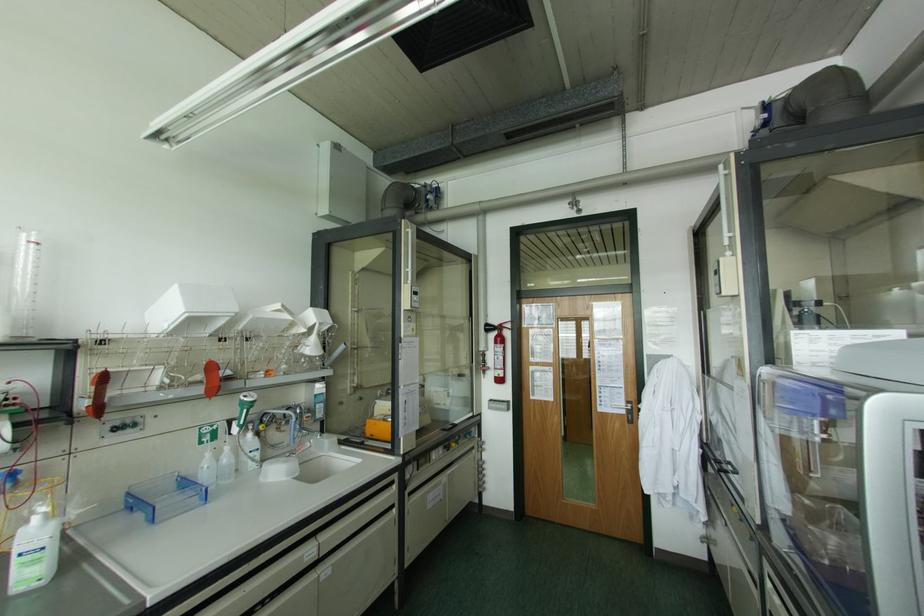
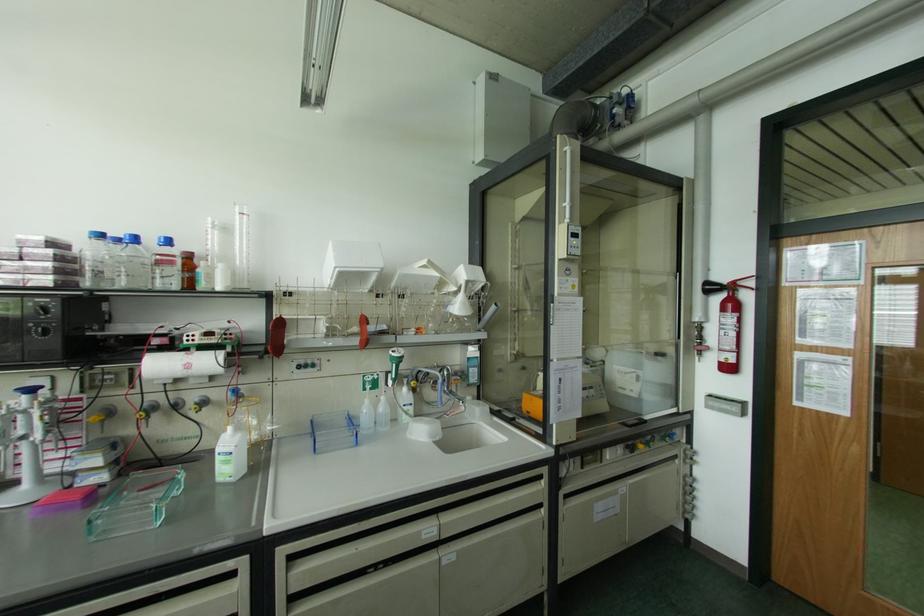
Locate, in the second image, the point that corresponds to [241,426] in the first image.

(394, 379)